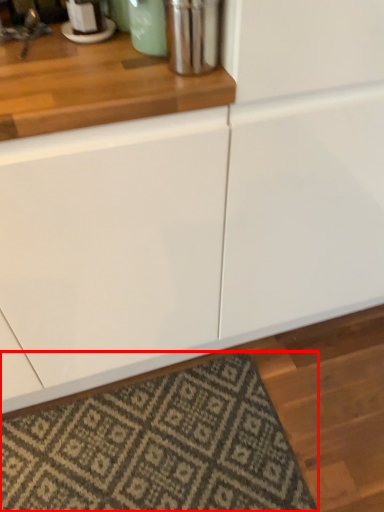
Question: In this image, where is mat (annotated by the red box) located relative to appliance?

Choices:
 (A) left
 (B) right

Answer: (A)